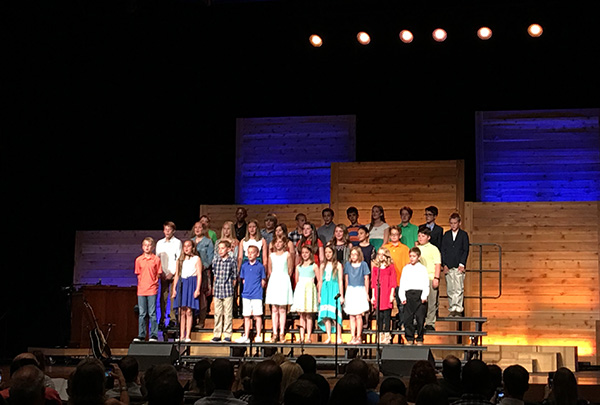
This screenshot has width=600, height=405. What are the coordinates of `lights` in the screenshot? It's located at (314, 38), (365, 31), (405, 32), (439, 35), (485, 32), (535, 27).